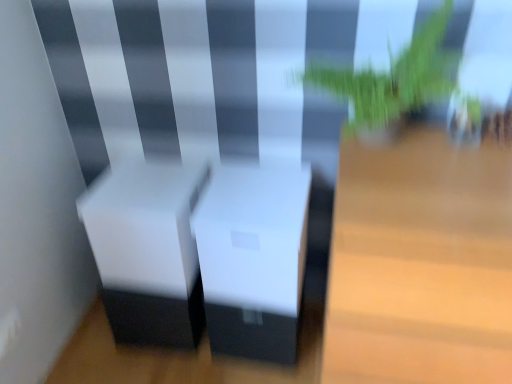
Question: Is green leafy plant at upper right positioned with its back to white matte table at center, positioned as the second table in right-to-left order?

Choices:
 (A) yes
 (B) no

Answer: (B)

Question: Is green leafy plant at upper right taller than white matte table at center, which is counted as the 1th table, starting from the left?

Choices:
 (A) no
 (B) yes

Answer: (B)

Question: From a real-world perspective, is green leafy plant at upper right located higher than white matte table at center, which is counted as the 1th table, starting from the left?

Choices:
 (A) yes
 (B) no

Answer: (A)

Question: Does green leafy plant at upper right appear on the right side of white matte table at center, positioned as the second table in right-to-left order?

Choices:
 (A) no
 (B) yes

Answer: (B)

Question: From a real-world perspective, is green leafy plant at upper right located beneath white matte table at center, which is counted as the 1th table, starting from the left?

Choices:
 (A) no
 (B) yes

Answer: (A)

Question: Is white matte table at center, positioned as the second table in right-to-left order, completely or partially inside green leafy plant at upper right?

Choices:
 (A) no
 (B) yes

Answer: (A)

Question: Does light wood table at center, positioned as the second table in left-to-right order, have a greater height compared to white matte table at center, which is counted as the 1th table, starting from the left?

Choices:
 (A) no
 (B) yes

Answer: (B)

Question: From a real-world perspective, is light wood table at center, which is the 1th table in right-to-left order, on top of white matte table at center, which is counted as the 1th table, starting from the left?

Choices:
 (A) yes
 (B) no

Answer: (B)

Question: Does light wood table at center, which is the 1th table in right-to-left order, lie behind white matte table at center, which is counted as the 1th table, starting from the left?

Choices:
 (A) no
 (B) yes

Answer: (A)

Question: Can you confirm if light wood table at center, which is the 1th table in right-to-left order, is shorter than white matte table at center, positioned as the second table in right-to-left order?

Choices:
 (A) yes
 (B) no

Answer: (B)

Question: Is light wood table at center, which is the 1th table in right-to-left order, not near white matte table at center, positioned as the second table in right-to-left order?

Choices:
 (A) yes
 (B) no

Answer: (B)

Question: Is light wood table at center, which is the 1th table in right-to-left order, oriented towards white matte table at center, positioned as the second table in right-to-left order?

Choices:
 (A) yes
 (B) no

Answer: (B)

Question: Is white matte table at center, positioned as the second table in right-to-left order, thinner than green leafy plant at upper right?

Choices:
 (A) no
 (B) yes

Answer: (A)